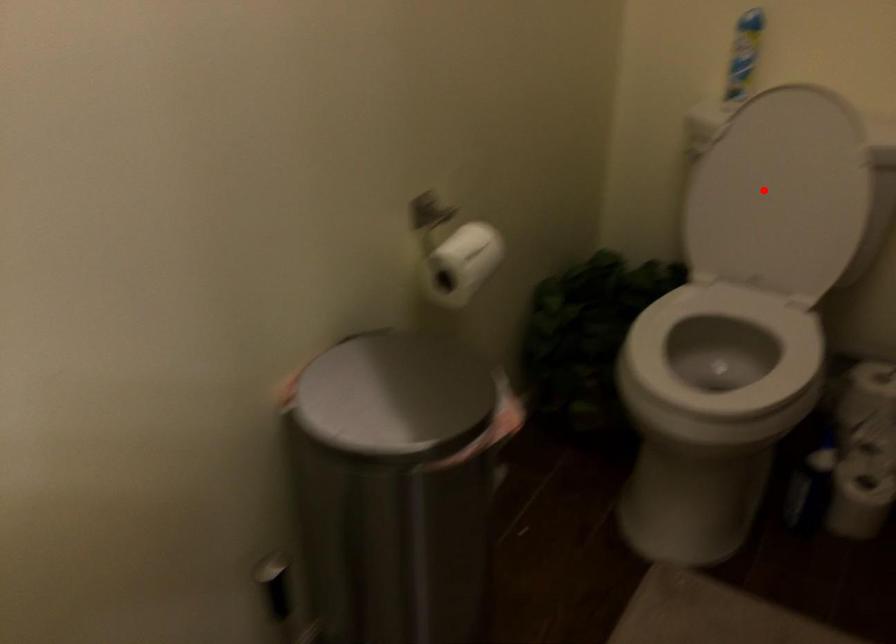
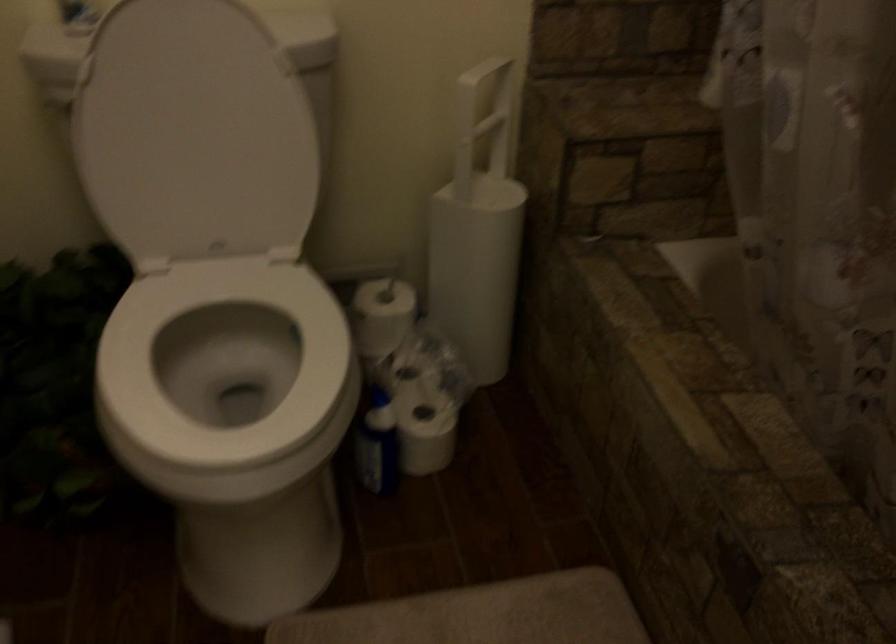
Question: I am providing you with two images of the same scene from different viewpoints. Given a red point in image1, look at the same physical point in image2. Is it:

Choices:
 (A) Closer to the viewpoint
 (B) Farther from the viewpoint

Answer: (A)